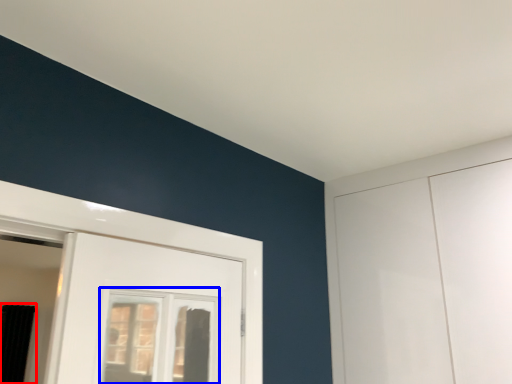
Question: Which point is further to the camera, curtain (highlighted by a red box) or window (highlighted by a blue box)?

Choices:
 (A) curtain
 (B) window

Answer: (A)